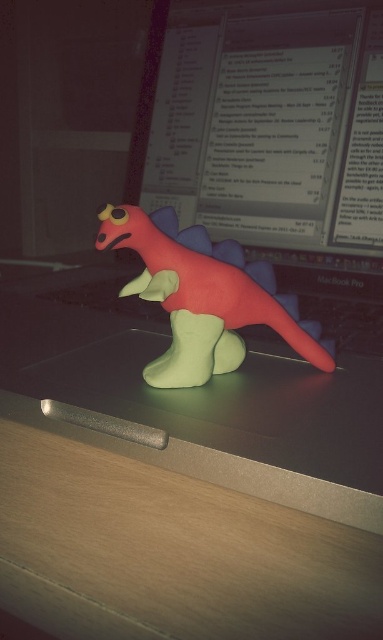
Can you confirm if wooden table at lower center is bigger than rubber-like red dinosaur at center?

Indeed, wooden table at lower center has a larger size compared to rubber-like red dinosaur at center.

Is point (111, 504) in front of point (142, 241)?

Yes, it is in front of point (142, 241).

Is point (147, 618) behind point (183, 272)?

No, it is in front of (183, 272).

Identify the location of wooden table at lower center. The width and height of the screenshot is (383, 640). (176, 541).

Can you confirm if wooden table at lower center is thinner than matte plastic computer screen at upper center?

Yes.

Between wooden table at lower center and matte plastic computer screen at upper center, which one is positioned higher?

matte plastic computer screen at upper center is higher up.

Does point (112, 592) come closer to viewer compared to point (381, 125)?

Yes.

This screenshot has height=640, width=383. Find the location of `wooden table at lower center`. wooden table at lower center is located at coordinates (176, 541).

Who is more forward, (x=134, y=138) or (x=248, y=301)?

Positioned in front is point (x=248, y=301).

Does matte plastic computer screen at upper center have a lesser width compared to rubber-like red dinosaur at center?

No.

Who is more distant from viewer, (328, 244) or (212, 300)?

The point (328, 244) is more distant.

Find the location of `matte plastic computer screen at upper center`. matte plastic computer screen at upper center is located at coordinates (266, 124).